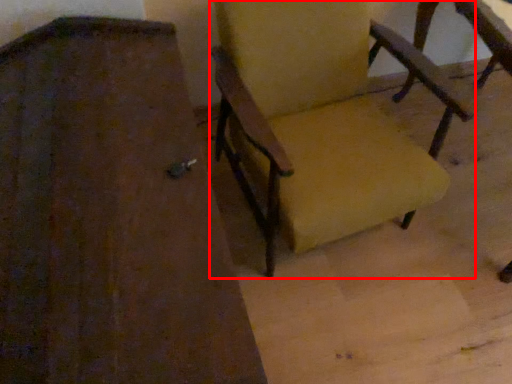
Question: From the image's perspective, considering the relative positions of chair (annotated by the red box) and chair in the image provided, where is chair (annotated by the red box) located with respect to the staircase?

Choices:
 (A) above
 (B) below

Answer: (A)